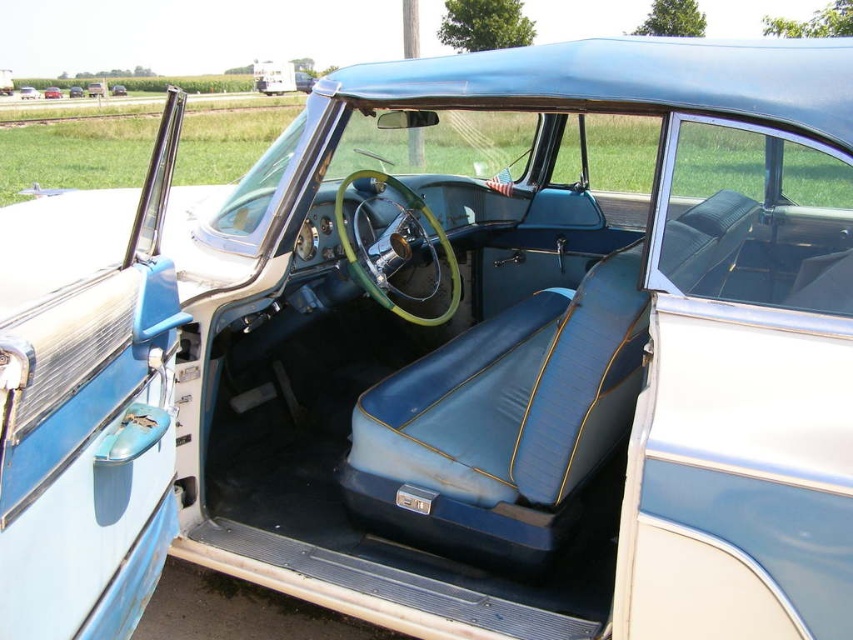
Question: Which point is farther from the camera taking this photo?

Choices:
 (A) (21, 88)
 (B) (57, 93)

Answer: (A)

Question: Which point is farther from the camera taking this photo?

Choices:
 (A) (51, 88)
 (B) (22, 92)

Answer: (B)

Question: In this image, where is matte blue leather car at center located relative to matte blue leather seats at center?

Choices:
 (A) below
 (B) above

Answer: (B)

Question: Does matte blue leather car at center appear on the right side of matte blue leather seats at center?

Choices:
 (A) no
 (B) yes

Answer: (A)

Question: Does matte blue leather car at center have a greater width compared to matte blue leather seats at center?

Choices:
 (A) yes
 (B) no

Answer: (A)

Question: Which object appears farthest from the camera in this image?

Choices:
 (A) matte blue leather car at center
 (B) matte blue leather seats at center

Answer: (B)